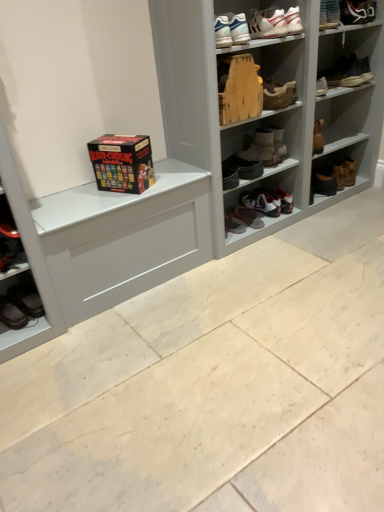
Question: Considering the positions of wooden shoe at upper center, positioned as the 8th footwear in left-to-right order, and white painted wood shelf at upper center in the image, is wooden shoe at upper center, positioned as the 8th footwear in left-to-right order, bigger or smaller than white painted wood shelf at upper center?

Choices:
 (A) big
 (B) small

Answer: (B)

Question: Considering the positions of wooden shoe at upper center, positioned as the 8th footwear in left-to-right order, and white painted wood shelf at upper center in the image, is wooden shoe at upper center, positioned as the 8th footwear in left-to-right order, taller or shorter than white painted wood shelf at upper center?

Choices:
 (A) tall
 (B) short

Answer: (B)

Question: Which object is positioned farthest from the black leather shoes at lower left, which appears as the first footwear when viewed from the left?

Choices:
 (A) black leather boot at lower right, which is counted as the 12th footwear, starting from the left
 (B) white leather sneaker at upper right, acting as the 11th footwear starting from the left
 (C) white leather sneaker at center, the 9th footwear in the left-to-right sequence
 (D) leather boots at center, which appears as the ninth footwear when viewed from the right
 (E) white leather sneaker at center, placed as the sixth footwear when sorted from left to right

Answer: (B)

Question: Considering the real-world distances, which object is closest to the black leather shoe at center right, the tenth footwear from the left?

Choices:
 (A) matt black board game box at center
 (B) brown leather boot at upper right, which is the thirteenth footwear in left-to-right order
 (C) black leather boot at lower right, the second footwear viewed from the right
 (D) white painted wood shelf at upper center
 (E) leather boots at center, marked as the fifth footwear in a left-to-right arrangement

Answer: (C)